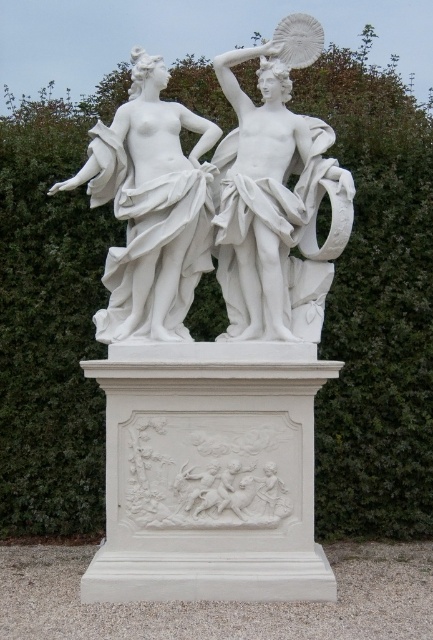
Question: Does white marble statue at center have a lesser width compared to white marble statue at left?

Choices:
 (A) yes
 (B) no

Answer: (A)

Question: Is white marble statue at center thinner than white marble statue at left?

Choices:
 (A) yes
 (B) no

Answer: (A)

Question: Which point is farther from the camera taking this photo?

Choices:
 (A) pos(284,90)
 (B) pos(81,180)

Answer: (A)

Question: From the image, what is the correct spatial relationship of white marble statue at center in relation to white marble statue at left?

Choices:
 (A) below
 (B) above

Answer: (B)